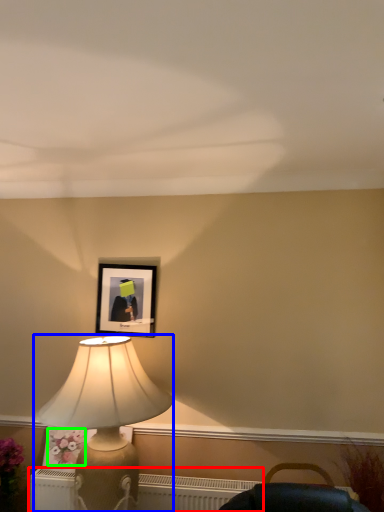
Question: Which is farther away from radiator (highlighted by a red box)? lamp (highlighted by a blue box) or flower (highlighted by a green box)?

Choices:
 (A) lamp
 (B) flower

Answer: (A)